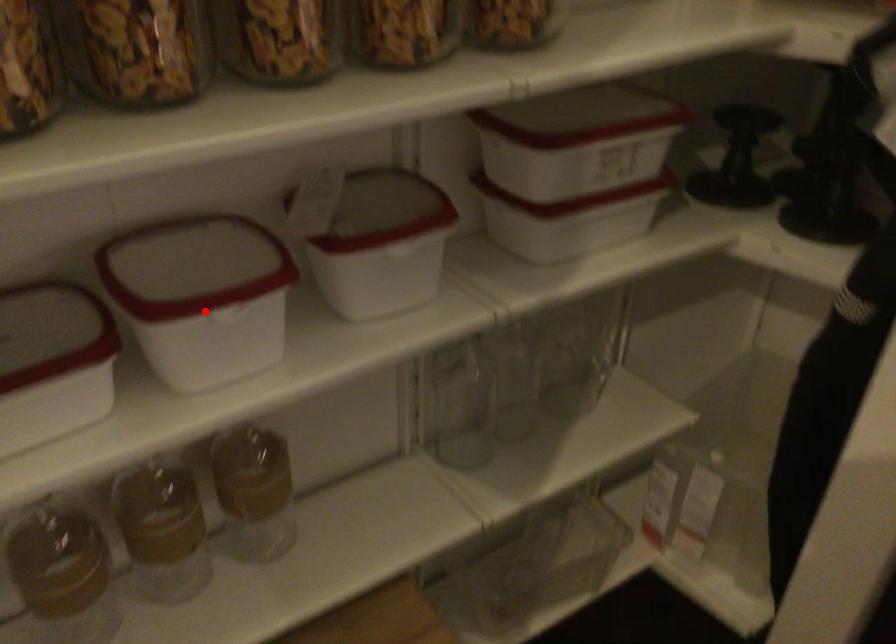
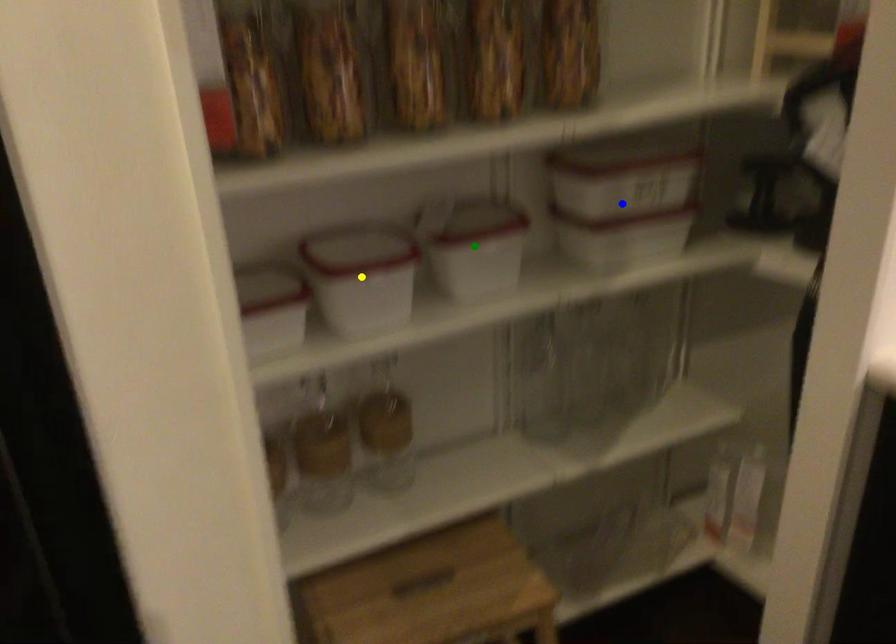
Question: I am providing you with two images of the same scene from different viewpoints. A red point is marked on the first image. You are given multiple points on the second image. In image 2, which mark is for the same physical point as the one in image 1?

Choices:
 (A) yellow point
 (B) blue point
 (C) green point

Answer: (A)